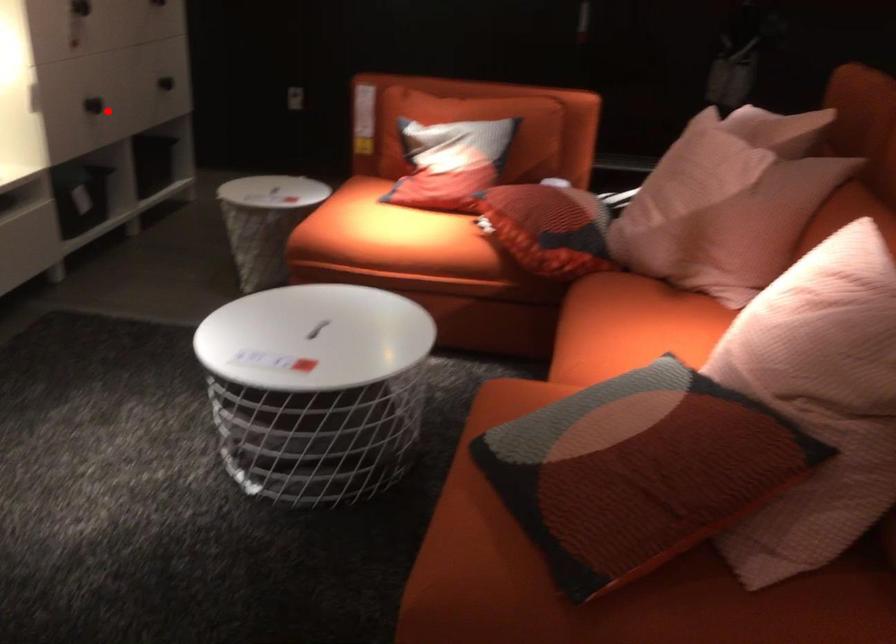
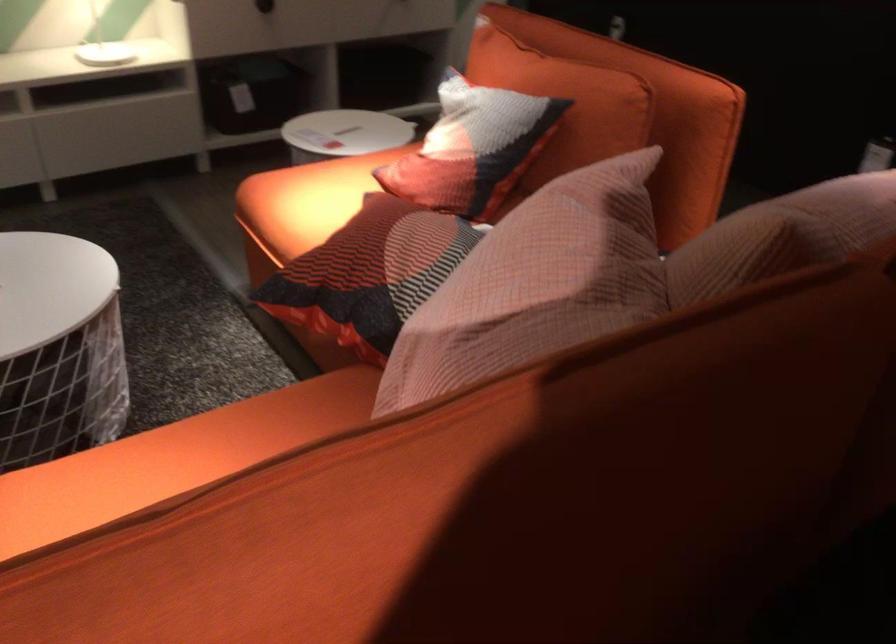
Question: I am providing you with two images of the same scene from different viewpoints. Given a red point in image1, look at the same physical point in image2. Is it:

Choices:
 (A) Closer to the viewpoint
 (B) Farther from the viewpoint

Answer: (A)